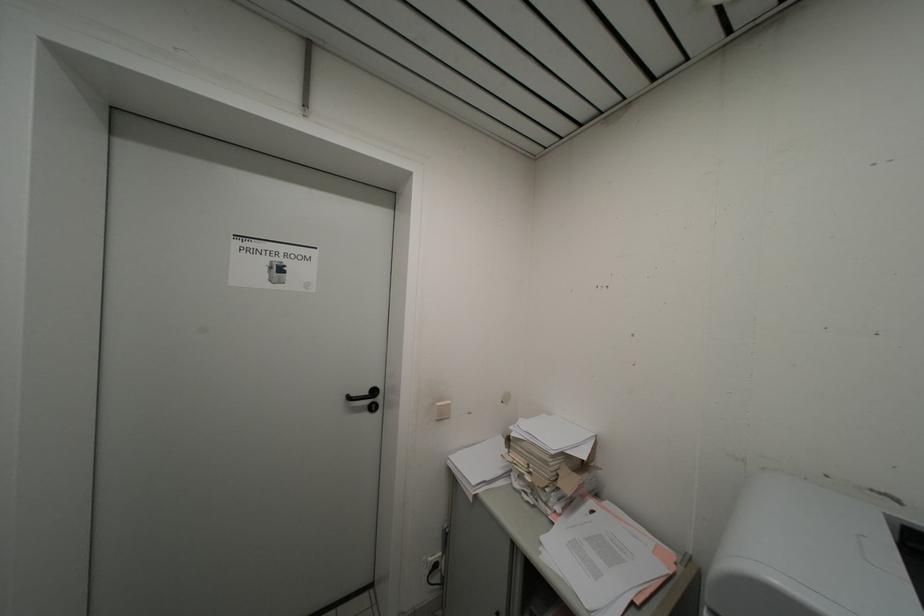
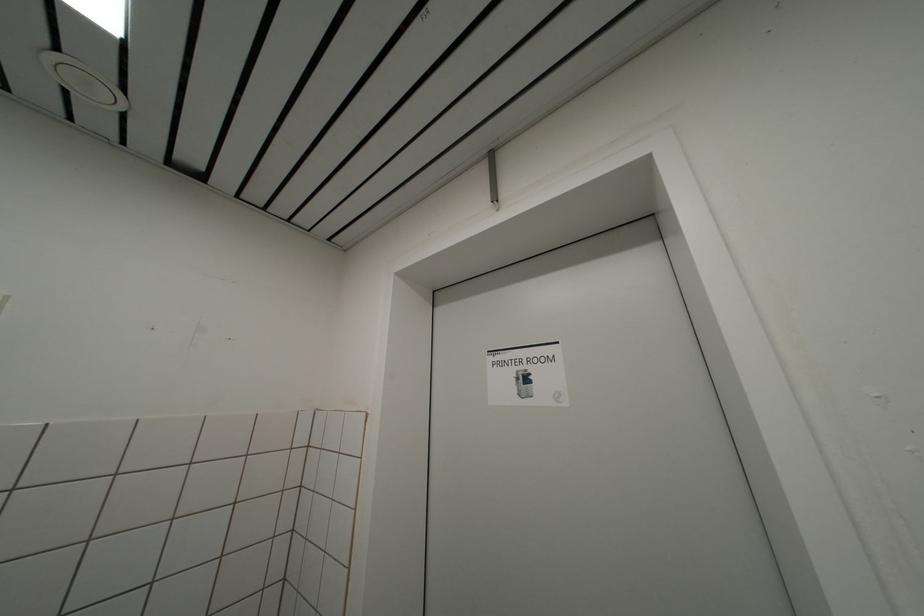
How did the camera likely rotate?

The camera's rotation is toward left-up.